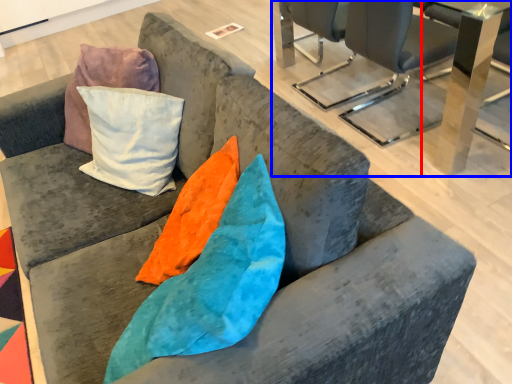
Question: Which object appears farthest to the camera in this image, table (highlighted by a red box) or table (highlighted by a blue box)?

Choices:
 (A) table
 (B) table

Answer: (A)